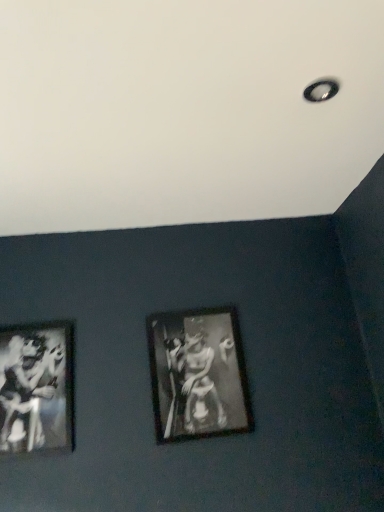
Question: Is point (8, 370) positioned closer to the camera than point (221, 314)?

Choices:
 (A) farther
 (B) closer

Answer: (B)

Question: In terms of width, does black glossy print at left look wider or thinner when compared to black matte picture frame at center?

Choices:
 (A) wide
 (B) thin

Answer: (B)

Question: From a real-world perspective, is black glossy print at left positioned above or below black matte picture frame at center?

Choices:
 (A) below
 (B) above

Answer: (B)

Question: Is point (205, 380) positioned closer to the camera than point (43, 413)?

Choices:
 (A) closer
 (B) farther

Answer: (B)

Question: From a real-world perspective, is black matte picture frame at center above or below black glossy print at left?

Choices:
 (A) below
 (B) above

Answer: (A)

Question: Is black matte picture frame at center in front of or behind black glossy print at left in the image?

Choices:
 (A) front
 (B) behind

Answer: (B)

Question: Which is correct: black matte picture frame at center is inside black glossy print at left, or outside of it?

Choices:
 (A) inside
 (B) outside

Answer: (B)